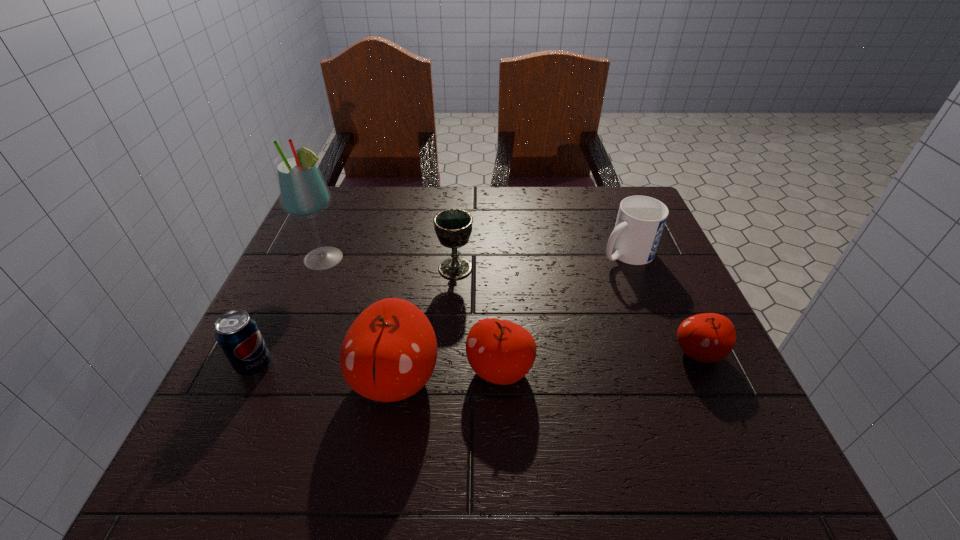
This screenshot has width=960, height=540. What are the coordinates of `vacant space in between the second apple from left to right and the mug` in the screenshot? It's located at (563, 312).

Identify the location of free space that is in between the soda can and the mug. (441, 309).

You are a GUI agent. You are given a task and a screenshot of the screen. Output one action in this format:
    pyautogui.click(x=<x>, y=<y>)
    Task: Click on the vacant area that lies between the shortest apple and the tallest apple
    The width and height of the screenshot is (960, 540).
    Given the screenshot: What is the action you would take?
    pyautogui.click(x=546, y=366)

What are the coordinates of `free area in between the mug and the chalice` in the screenshot? It's located at (540, 261).

This screenshot has height=540, width=960. Find the location of `vacant space that's between the shortest apple and the tallest apple`. vacant space that's between the shortest apple and the tallest apple is located at coordinates (546, 366).

The height and width of the screenshot is (540, 960). What are the coordinates of `free space between the soda can and the mug` in the screenshot? It's located at (441, 309).

You are a GUI agent. You are given a task and a screenshot of the screen. Output one action in this format:
    pyautogui.click(x=<x>, y=<y>)
    Task: Click on the blank region between the chalice and the mug
    
    Given the screenshot: What is the action you would take?
    pyautogui.click(x=540, y=261)

Identify the location of object that is the closest to the rightmost apple. The image size is (960, 540). (640, 221).

The height and width of the screenshot is (540, 960). In order to click on object identified as the fifth closest to the tallest object in this screenshot , I will do `click(640, 221)`.

I want to click on the closest apple to the shortest object, so click(499, 351).